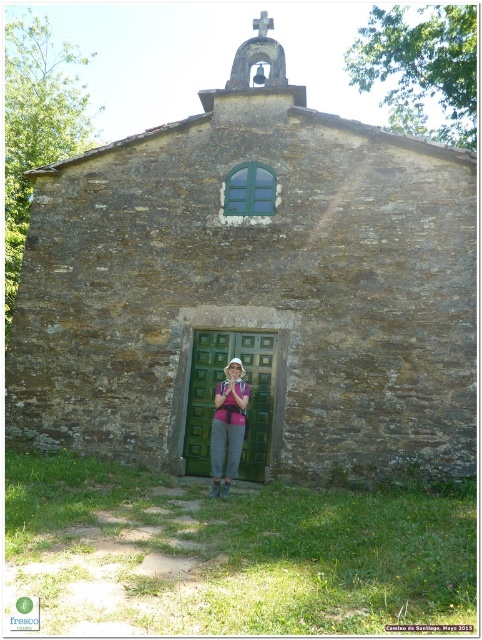
You are standing in front of the brown stone church at center and see the pink fabric at center in front of it. Which object is closer to you?

The brown stone church at center is closer to the viewer than the pink fabric at center.

You are a visitor approaching the brown stone church at center and the pink fabric at center. Which object will you see first as you walk towards the church?

The pink fabric at center will be seen first because the brown stone church at center is positioned to its right, meaning the pink fabric is closer to the path of approach.

You are a visitor approaching the brown stone church at center. You notice the green matte door at center. How does the size of the church compare to the door?

The brown stone church at center is larger in size compared to the green matte door at center.